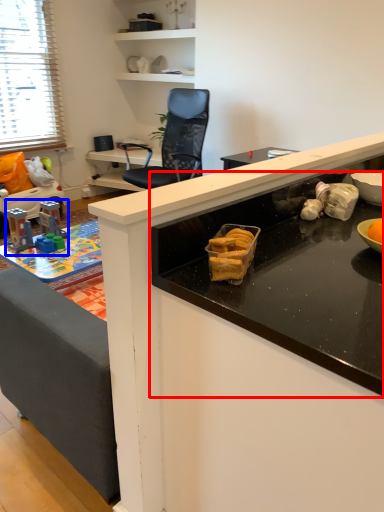
Question: Among these objects, which one is farthest to the camera, countertop (highlighted by a red box) or toy (highlighted by a blue box)?

Choices:
 (A) countertop
 (B) toy

Answer: (B)